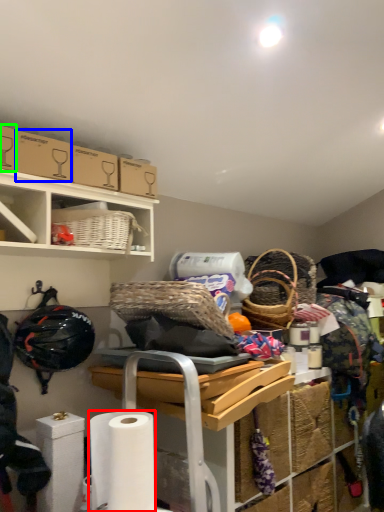
Question: Which object is positioned closest to toilet paper (highlighted by a red box)? Select from cardboard box (highlighted by a blue box) and storage box (highlighted by a green box).

Choices:
 (A) cardboard box
 (B) storage box

Answer: (A)